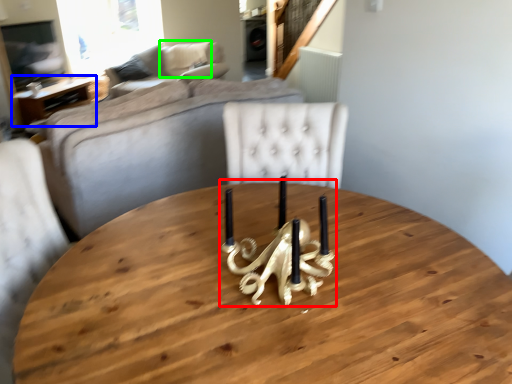
Question: Based on their relative distances, which object is nearer to candle holder (highlighted by a red box)? Choose from table (highlighted by a blue box) and pillow (highlighted by a green box).

Choices:
 (A) table
 (B) pillow

Answer: (A)